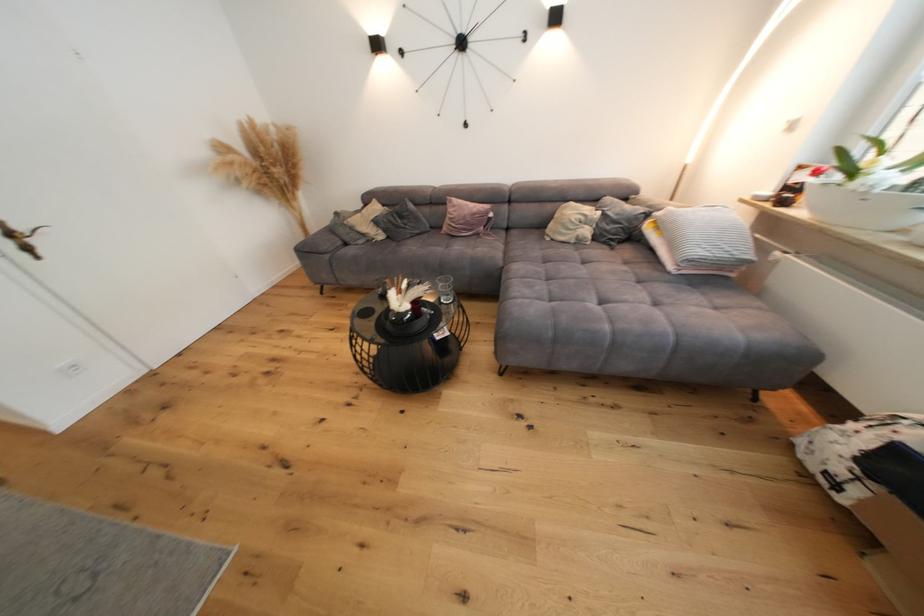
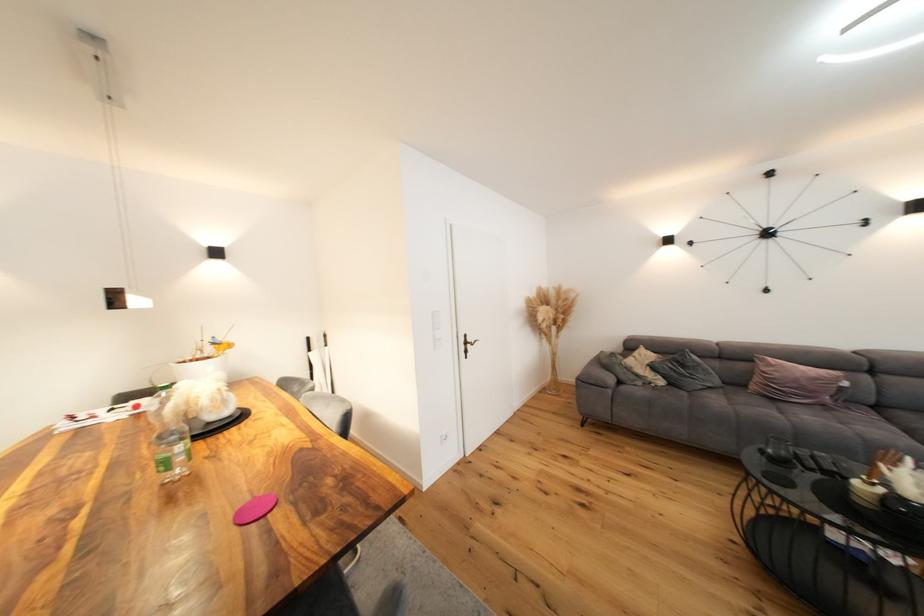
Find the pixel in the second image that matches (359,230) in the first image.

(637, 371)